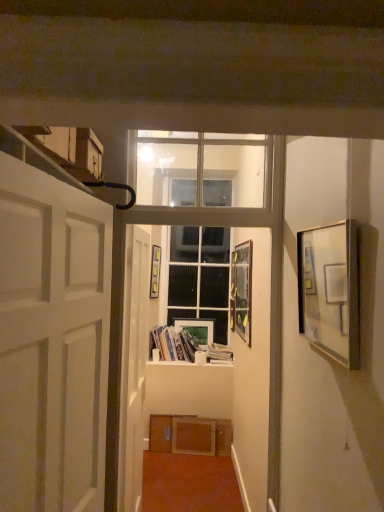
Question: Is matte gold picture frame at center, the third picture frame from the front, shorter than white matte door at center, positioned as the second door in front-to-back order?

Choices:
 (A) no
 (B) yes

Answer: (B)

Question: Can we say matte gold picture frame at center, arranged as the 4th picture frame when viewed from the right, lies outside white matte door at center, positioned as the second door in front-to-back order?

Choices:
 (A) yes
 (B) no

Answer: (A)

Question: Considering the relative sizes of matte gold picture frame at center, the third picture frame from the front, and white matte door at center, the first door from the back, in the image provided, is matte gold picture frame at center, the third picture frame from the front, wider than white matte door at center, the first door from the back,?

Choices:
 (A) yes
 (B) no

Answer: (B)

Question: Is matte gold picture frame at center, acting as the 2th picture frame starting from the back, facing away from white matte door at center, the first door from the back?

Choices:
 (A) yes
 (B) no

Answer: (B)

Question: Does matte gold picture frame at center, the third picture frame from the front, appear on the left side of white matte door at center, the first door from the back?

Choices:
 (A) no
 (B) yes

Answer: (B)

Question: In terms of height, does white paper book at center, the first book in the right-to-left sequence, look taller or shorter compared to clear glass window at upper center, which is the 1th window frame in top-to-bottom order?

Choices:
 (A) short
 (B) tall

Answer: (A)

Question: In the image, is white paper book at center, the first book in the right-to-left sequence, on the left side or the right side of clear glass window at upper center, positioned as the first window frame in front-to-back order?

Choices:
 (A) right
 (B) left

Answer: (A)

Question: Considering the positions of white paper book at center, which ranks as the 2th book in left-to-right order, and clear glass window at upper center, positioned as the first window frame in front-to-back order, in the image, is white paper book at center, which ranks as the 2th book in left-to-right order, bigger or smaller than clear glass window at upper center, positioned as the first window frame in front-to-back order,?

Choices:
 (A) small
 (B) big

Answer: (A)

Question: From the image's perspective, relative to clear glass window at upper center, which is the 1th window frame in top-to-bottom order, is white paper book at center, which ranks as the 2th book in left-to-right order, above or below?

Choices:
 (A) above
 (B) below

Answer: (B)

Question: From the image's perspective, is clear glass window at upper center, positioned as the first window frame in front-to-back order, positioned above or below wooden at center?

Choices:
 (A) below
 (B) above

Answer: (B)

Question: Is point (268, 225) closer or farther from the camera than point (221, 360)?

Choices:
 (A) farther
 (B) closer

Answer: (B)

Question: From a real-world perspective, relative to wooden at center, is clear glass window at upper center, the 2th window frame in the back-to-front sequence, vertically above or below?

Choices:
 (A) above
 (B) below

Answer: (A)

Question: Considering the relative positions of clear glass window at upper center, positioned as the first window frame in front-to-back order, and wooden at center in the image provided, is clear glass window at upper center, positioned as the first window frame in front-to-back order, to the left or to the right of wooden at center?

Choices:
 (A) left
 (B) right

Answer: (B)

Question: Would you say matte glass picture frame at right, the 4th picture frame from the left, is to the left or to the right of white matte door at left, the 1th door from the front, in the picture?

Choices:
 (A) right
 (B) left

Answer: (A)

Question: From a real-world perspective, is matte glass picture frame at right, which is the first picture frame in front-to-back order, positioned above or below white matte door at left, which is counted as the second door, starting from the back?

Choices:
 (A) below
 (B) above

Answer: (B)